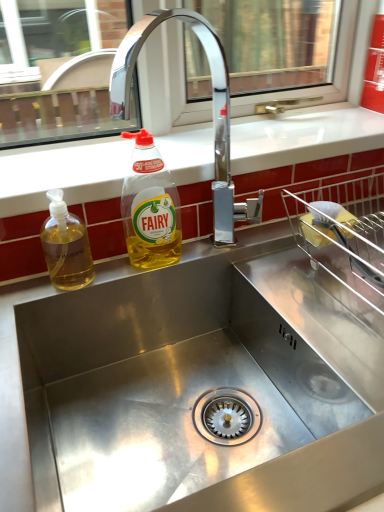
Question: In terms of width, does chrome metallic faucet at upper center look wider or thinner when compared to translucent yellow liquid at sink left, the 2th bottle when ordered from right to left?

Choices:
 (A) thin
 (B) wide

Answer: (B)

Question: Choose the correct answer: Is chrome metallic faucet at upper center inside translucent yellow liquid at sink left, the 2th bottle when ordered from right to left, or outside it?

Choices:
 (A) outside
 (B) inside

Answer: (A)

Question: Estimate the real-world distances between objects in this image. Which object is closer to the translucent yellow liquid at sink left, the 2th bottle when ordered from right to left?

Choices:
 (A) yellow translucent liquid at upper center, positioned as the first bottle in right-to-left order
 (B) white glossy countertop at upper center
 (C) chrome metallic faucet at upper center

Answer: (A)

Question: Based on their relative distances, which object is farther from the translucent yellow liquid at sink left, which is counted as the first bottle, starting from the left?

Choices:
 (A) yellow translucent liquid at upper center, positioned as the first bottle in right-to-left order
 (B) chrome metallic faucet at upper center
 (C) white glossy countertop at upper center

Answer: (B)